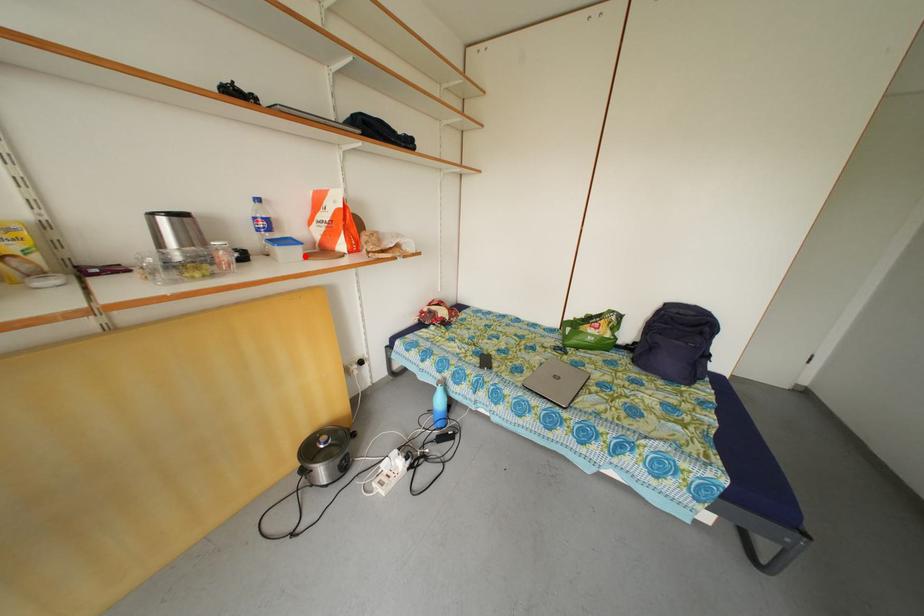
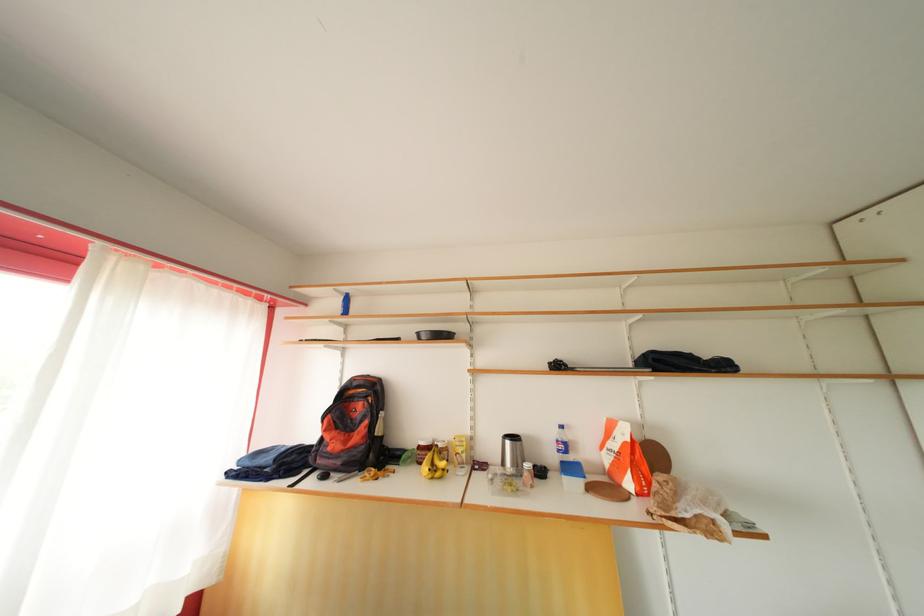
In the second image, find the point that corresponds to the highlighted location in the first image.

(587, 488)